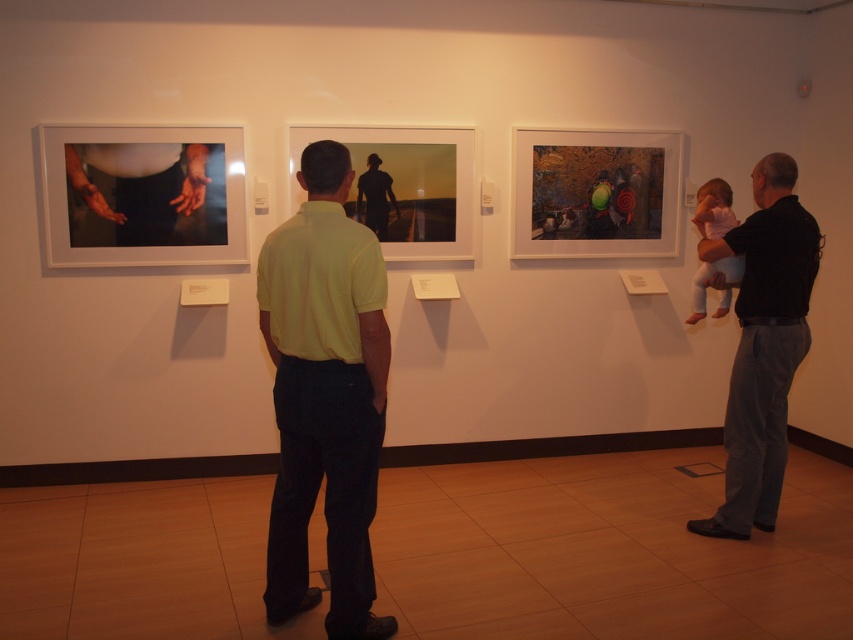
Can you confirm if light green polo shirt at center is positioned below silhouette figure at center?

Yes.

Is the position of light green polo shirt at center less distant than that of silhouette figure at center?

Yes, light green polo shirt at center is in front of silhouette figure at center.

The height and width of the screenshot is (640, 853). What are the coordinates of `light green polo shirt at center` in the screenshot? It's located at pyautogui.click(x=325, y=396).

Does light green polo shirt at center have a larger size compared to pink fabric baby at right?

Correct, light green polo shirt at center is larger in size than pink fabric baby at right.

Who is taller, light green polo shirt at center or pink fabric baby at right?

light green polo shirt at center is taller.

Who is more forward, (368, 467) or (724, 269)?

Positioned in front is point (368, 467).

Identify the location of light green polo shirt at center. (325, 396).

Does black cotton shirt at right have a greater width compared to pink fabric baby at right?

Correct, the width of black cotton shirt at right exceeds that of pink fabric baby at right.

Is black cotton shirt at right closer to camera compared to pink fabric baby at right?

That is True.

The height and width of the screenshot is (640, 853). What do you see at coordinates (762, 344) in the screenshot?
I see `black cotton shirt at right` at bounding box center [762, 344].

Locate an element on the screen. Image resolution: width=853 pixels, height=640 pixels. black cotton shirt at right is located at coordinates (762, 344).